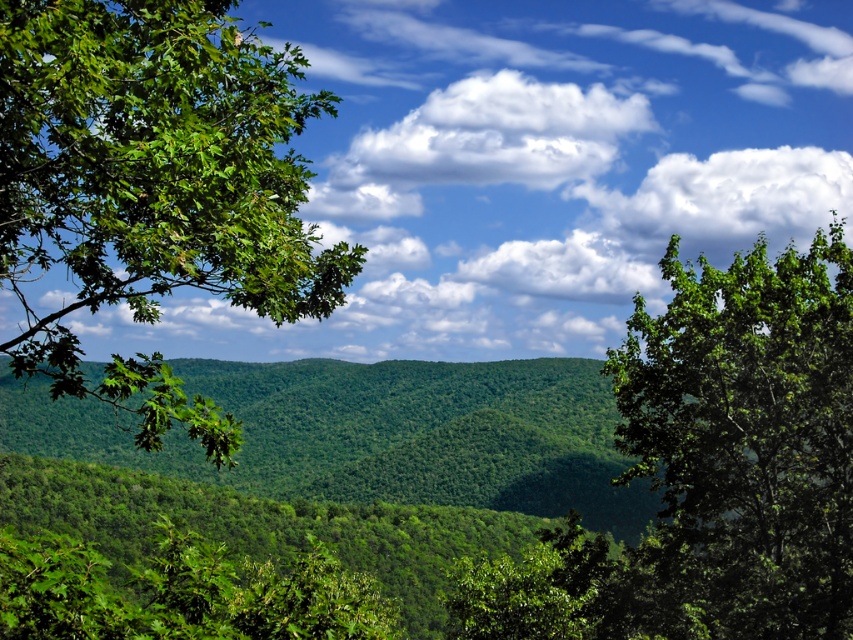
Is green leafy tree at right in front of white fluffy cloud at upper center?

Yes, it is.

Is green leafy tree at right thinner than white fluffy cloud at upper center?

Yes.

Which is in front, point (724, 284) or point (540, 86)?

Point (724, 284) is more forward.

Image resolution: width=853 pixels, height=640 pixels. Identify the location of green leafy tree at right. (740, 449).

Does green leafy branch at left have a lesser width compared to green leafy tree at right?

Incorrect, green leafy branch at left's width is not less than green leafy tree at right's.

Does point (44, 340) come behind point (735, 444)?

No, (44, 340) is closer to viewer.

Identify the location of green leafy branch at left. This screenshot has width=853, height=640. (154, 186).

Image resolution: width=853 pixels, height=640 pixels. I want to click on green leafy branch at left, so click(154, 186).

What do you see at coordinates (154, 186) in the screenshot? This screenshot has width=853, height=640. I see `green leafy branch at left` at bounding box center [154, 186].

Is point (231, 428) farther from viewer compared to point (525, 161)?

No.

The width and height of the screenshot is (853, 640). What are the coordinates of `green leafy branch at left` in the screenshot? It's located at (154, 186).

Identify the location of green leafy branch at left. The image size is (853, 640). (154, 186).